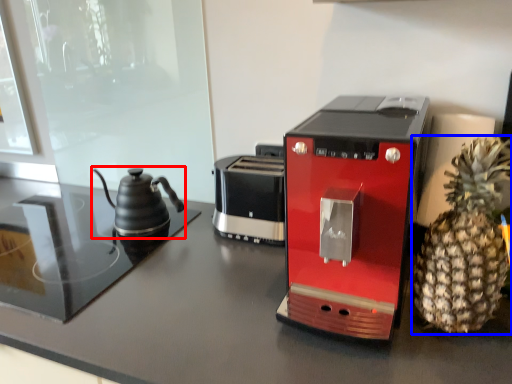
Question: Which point is further to the camera, kettle (highlighted by a red box) or pineapple (highlighted by a blue box)?

Choices:
 (A) kettle
 (B) pineapple

Answer: (A)